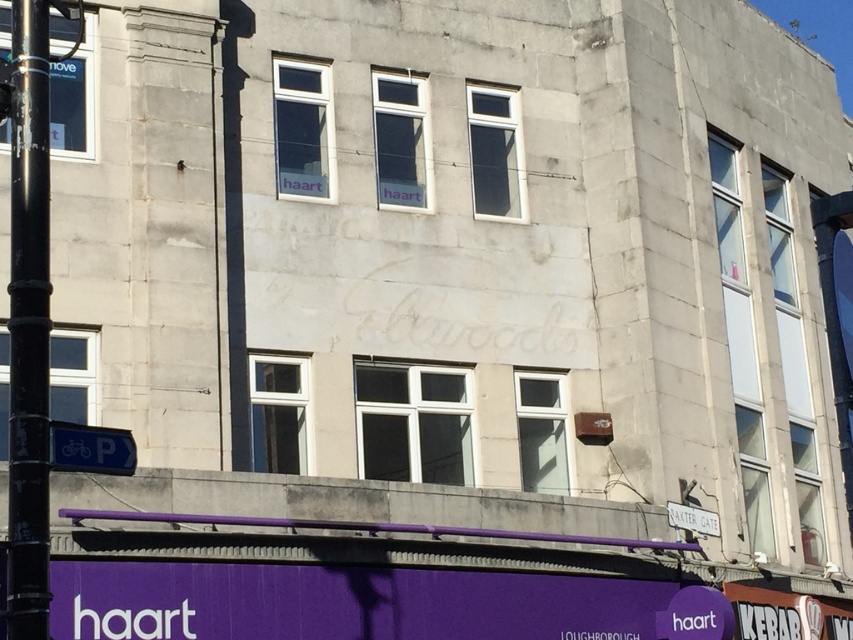
Does blue plastic parking sign at lower left have a lesser width compared to white plastic sign at lower right?

Correct, blue plastic parking sign at lower left's width is less than white plastic sign at lower right's.

Describe the element at coordinates (91, 449) in the screenshot. Image resolution: width=853 pixels, height=640 pixels. I see `blue plastic parking sign at lower left` at that location.

Is point (120, 465) positioned after point (692, 525)?

No, it is not.

The height and width of the screenshot is (640, 853). I want to click on blue plastic parking sign at lower left, so click(91, 449).

Who is positioned more to the right, black metallic pole at left or white plastic sign at lower right?

Positioned to the right is white plastic sign at lower right.

Is black metallic pole at left positioned at the back of white plastic sign at lower right?

That is False.

Locate an element on the screen. The image size is (853, 640). black metallic pole at left is located at coordinates (28, 324).

Who is positioned more to the right, black metallic pole at left or blue plastic parking sign at lower left?

blue plastic parking sign at lower left

Between point (20, 113) and point (51, 436), which one is positioned behind?

Positioned behind is point (20, 113).

This screenshot has width=853, height=640. Find the location of `black metallic pole at left`. black metallic pole at left is located at coordinates (28, 324).